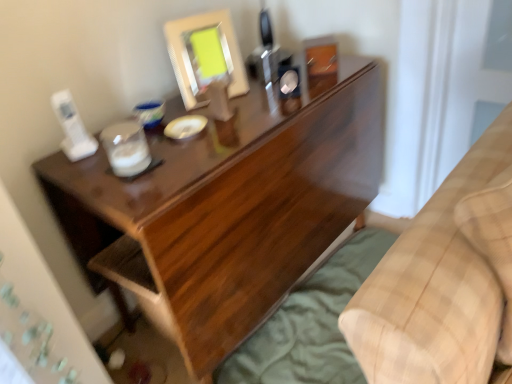
Image resolution: width=512 pixels, height=384 pixels. Describe the element at coordinates (310, 324) in the screenshot. I see `green fabric sheet at lower right` at that location.

What is the approximate height of beige plaid blanket at lower right?

22.41 inches.

Where is `beige plaid blanket at lower right`? beige plaid blanket at lower right is located at coordinates (444, 279).

What do you see at coordinates (226, 211) in the screenshot? Image resolution: width=512 pixels, height=384 pixels. I see `dark wood desk at center` at bounding box center [226, 211].

Identify the location of matte white frame at upper center. (205, 56).

Is dark wood desk at center aimed at green fabric sheet at lower right?

Yes, dark wood desk at center is turned towards green fabric sheet at lower right.

Identify the location of sheet below the dark wood desk at center (from the image's perspective). (310, 324).

Is dark wood desk at center inside or outside of green fabric sheet at lower right?

dark wood desk at center lies outside green fabric sheet at lower right.

Considering the positions of objects dark wood desk at center and green fabric sheet at lower right in the image provided, who is in front, dark wood desk at center or green fabric sheet at lower right?

dark wood desk at center is closer to the camera.

Would you consider matte white frame at upper center to be distant from dark wood desk at center?

No, matte white frame at upper center is not far from dark wood desk at center.

How distant is matte white frame at upper center from dark wood desk at center?

12.87 inches.

Which is behind, matte white frame at upper center or dark wood desk at center?

matte white frame at upper center is further from the camera.

Looking at this image, is matte white frame at upper center facing towards dark wood desk at center?

No.

Is the position of dark wood desk at center more distant than that of matte white frame at upper center?

No, dark wood desk at center is in front of matte white frame at upper center.

Is dark wood desk at center beside matte white frame at upper center?

They are not placed beside each other.

Is dark wood desk at center positioned beyond the bounds of matte white frame at upper center?

Indeed, dark wood desk at center is completely outside matte white frame at upper center.

Find the location of a particular element. This screenshot has height=384, width=512. desk in front of the matte white frame at upper center is located at coordinates tap(226, 211).

Is green fabric sheet at lower right inside the boundaries of matte white frame at upper center, or outside?

green fabric sheet at lower right lies outside matte white frame at upper center.

Considering the relative positions of green fabric sheet at lower right and matte white frame at upper center in the image provided, is green fabric sheet at lower right to the right of matte white frame at upper center from the viewer's perspective?

Yes.

Are green fabric sheet at lower right and matte white frame at upper center far apart?

No, green fabric sheet at lower right is not far from matte white frame at upper center.

Is green fabric sheet at lower right facing away from matte white frame at upper center?

No, green fabric sheet at lower right is not facing the opposite direction of matte white frame at upper center.

Is beige plaid blanket at lower right to the right of matte white frame at upper center from the viewer's perspective?

Indeed, beige plaid blanket at lower right is positioned on the right side of matte white frame at upper center.

Considering the positions of points (453, 171) and (205, 96), is point (453, 171) farther from camera compared to point (205, 96)?

No, it is not.

Which of these two, beige plaid blanket at lower right or matte white frame at upper center, is smaller?

matte white frame at upper center.

Can you tell me how much beige plaid blanket at lower right and matte white frame at upper center differ in facing direction?

13.6 degrees.

In the image, there is a beige plaid blanket at lower right. Where is `sheet below it (from the image's perspective)`? sheet below it (from the image's perspective) is located at coordinates (310, 324).

From the picture: Considering the positions of objects green fabric sheet at lower right and beige plaid blanket at lower right in the image provided, who is more to the left, green fabric sheet at lower right or beige plaid blanket at lower right?

From the viewer's perspective, green fabric sheet at lower right appears more on the left side.

Is green fabric sheet at lower right completely or partially outside of beige plaid blanket at lower right?

That's correct, green fabric sheet at lower right is outside of beige plaid blanket at lower right.

How different are the orientations of green fabric sheet at lower right and beige plaid blanket at lower right in degrees?

50.6 degrees.

Is beige plaid blanket at lower right a part of matte white frame at upper center?

Actually, beige plaid blanket at lower right is outside matte white frame at upper center.

From the image's perspective, is matte white frame at upper center under beige plaid blanket at lower right?

Actually, matte white frame at upper center appears above beige plaid blanket at lower right in the image.

Does matte white frame at upper center have a greater height compared to beige plaid blanket at lower right?

No, matte white frame at upper center is not taller than beige plaid blanket at lower right.

From the picture: From a real-world perspective, which is physically above, matte white frame at upper center or beige plaid blanket at lower right?

matte white frame at upper center is physically above.

In order to click on sheet behind the dark wood desk at center in this screenshot , I will do `click(310, 324)`.

You are a GUI agent. You are given a task and a screenshot of the screen. Output one action in this format:
    pyautogui.click(x=<x>, y=<y>)
    Task: Click on the mirror on the left of dark wood desk at center
    This screenshot has height=384, width=512.
    Given the screenshot: What is the action you would take?
    [x=205, y=56]

Looking at the image, which one is located further to green fabric sheet at lower right, dark wood desk at center or matte white frame at upper center?

Among the two, matte white frame at upper center is located further to green fabric sheet at lower right.

Based on their spatial positions, is dark wood desk at center or green fabric sheet at lower right closer to matte white frame at upper center?

Based on the image, dark wood desk at center appears to be nearer to matte white frame at upper center.

Looking at the image, which one is located closer to dark wood desk at center, beige plaid blanket at lower right or green fabric sheet at lower right?

green fabric sheet at lower right.

Considering their positions, is matte white frame at upper center positioned closer to dark wood desk at center than green fabric sheet at lower right?

matte white frame at upper center lies closer to dark wood desk at center than the other object.

From the image, which object appears to be farther from matte white frame at upper center, beige plaid blanket at lower right or dark wood desk at center?

beige plaid blanket at lower right.

Considering their positions, is matte white frame at upper center positioned closer to green fabric sheet at lower right than beige plaid blanket at lower right?

The object closer to green fabric sheet at lower right is beige plaid blanket at lower right.

From the image, which object appears to be farther from beige plaid blanket at lower right, green fabric sheet at lower right or matte white frame at upper center?

The object further to beige plaid blanket at lower right is matte white frame at upper center.

Based on their spatial positions, is matte white frame at upper center or beige plaid blanket at lower right further from dark wood desk at center?

beige plaid blanket at lower right is further to dark wood desk at center.

Where is `desk located between beige plaid blanket at lower right and matte white frame at upper center in the depth direction`? Image resolution: width=512 pixels, height=384 pixels. desk located between beige plaid blanket at lower right and matte white frame at upper center in the depth direction is located at coordinates (226, 211).

I want to click on furniture between matte white frame at upper center and green fabric sheet at lower right from top to bottom, so click(444, 279).

This screenshot has width=512, height=384. What are the coordinates of `desk between beige plaid blanket at lower right and green fabric sheet at lower right along the z-axis` in the screenshot? It's located at (226, 211).

Find the location of a particular element. desk between matte white frame at upper center and green fabric sheet at lower right in the vertical direction is located at coordinates (226, 211).